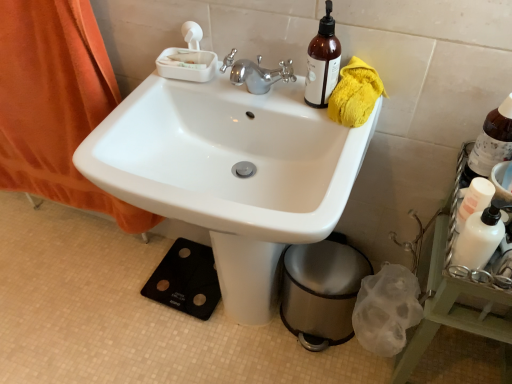
Find the location of a particular element. blank area beneath orange fabric curtain at left (from a real-world perspective) is located at coordinates coord(87,229).